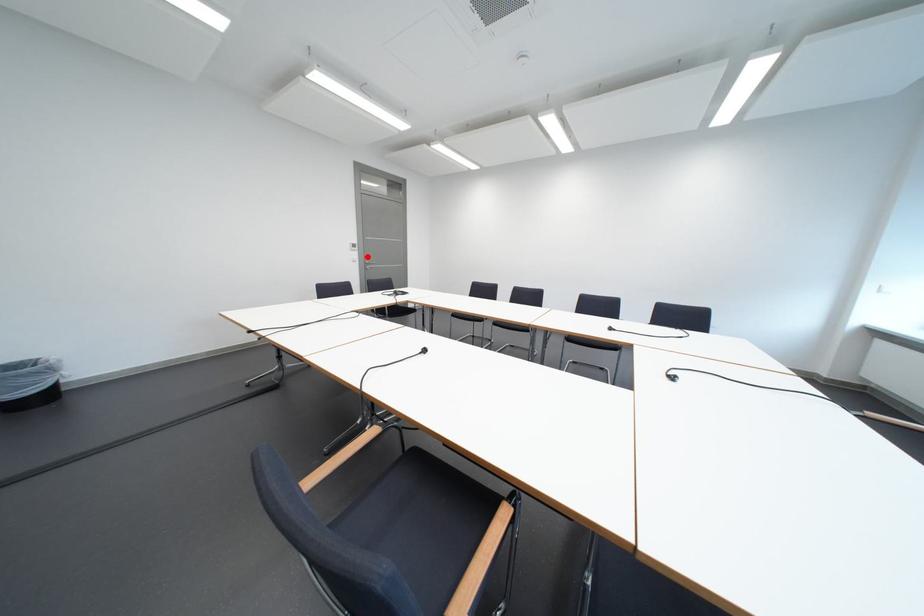
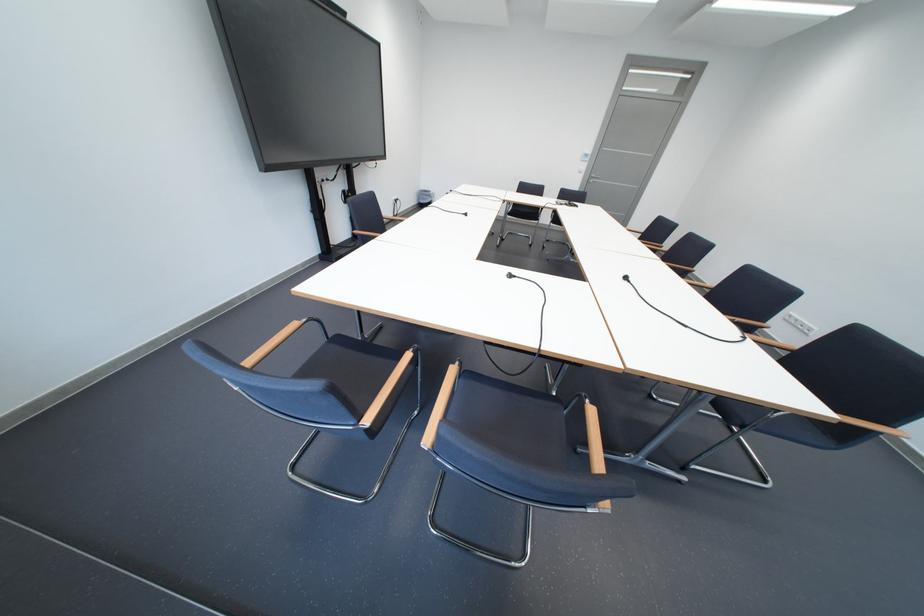
Locate, in the second image, the point that corresponds to the highlighted location in the first image.

(596, 168)